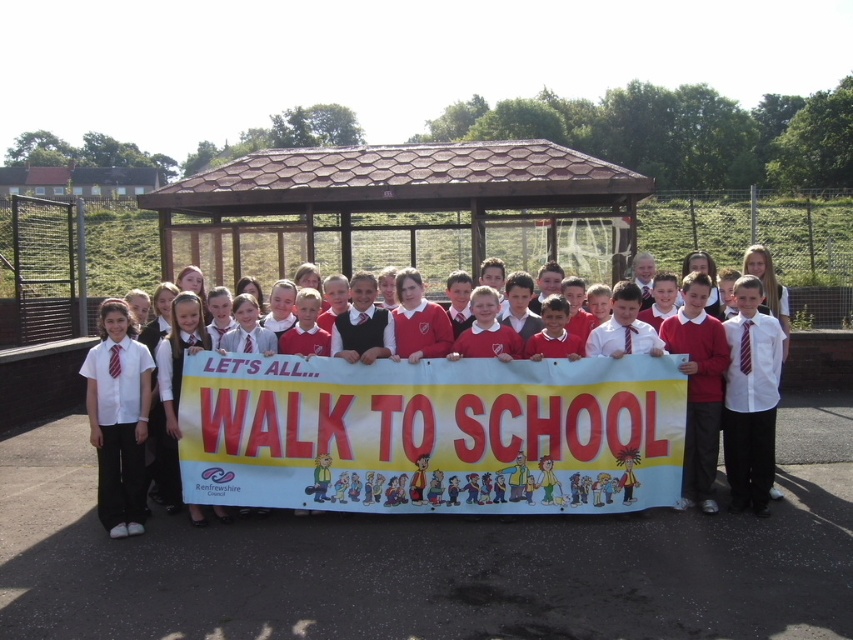
Question: Can you confirm if white glossy shirt at center is thinner than white shirt at left?

Choices:
 (A) yes
 (B) no

Answer: (B)

Question: Which object is positioned closest to the white glossy shirt at center?

Choices:
 (A) white paper banner at center
 (B) white shirt at left
 (C) white shirt with tie at right

Answer: (A)

Question: Observing the image, what is the correct spatial positioning of white glossy shirt at center in reference to white shirt with tie at right?

Choices:
 (A) below
 (B) above

Answer: (B)

Question: Which object is closer to the camera taking this photo?

Choices:
 (A) white shirt with tie at right
 (B) white paper banner at center

Answer: (B)

Question: Considering the relative positions of white paper banner at center and white shirt with tie at right in the image provided, where is white paper banner at center located with respect to white shirt with tie at right?

Choices:
 (A) above
 (B) below

Answer: (B)

Question: Among these points, which one is nearest to the camera?

Choices:
 (A) (128, 376)
 (B) (757, 326)
 (C) (554, 452)
 (D) (694, 282)

Answer: (A)